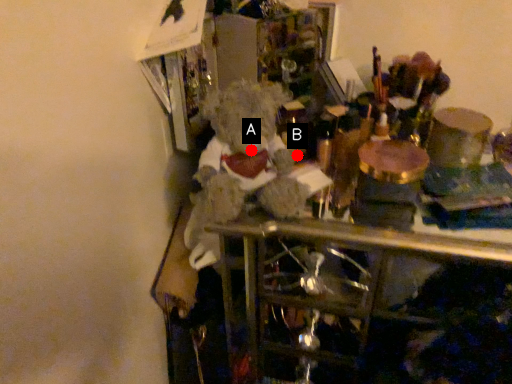
Question: Two points are circled on the image, labeled by A and B beside each circle. Which point is closer to the camera?

Choices:
 (A) A is closer
 (B) B is closer

Answer: (A)